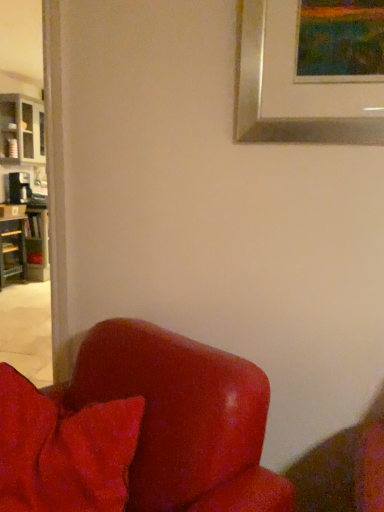
Question: From the image's perspective, is satin red armchair at lower left above or below wooden bookshelf at left?

Choices:
 (A) above
 (B) below

Answer: (B)

Question: Based on their positions, is satin red armchair at lower left located to the left or right of wooden bookshelf at left?

Choices:
 (A) right
 (B) left

Answer: (A)

Question: Which object is the closest to the satin red armchair at lower left?

Choices:
 (A) wooden bookshelf at left
 (B) velvety red pillow at lower left
 (C) matte gray cabinet at left

Answer: (B)

Question: Estimate the real-world distances between objects in this image. Which object is closer to the wooden bookshelf at left?

Choices:
 (A) velvety red pillow at lower left
 (B) matte gray cabinet at left
 (C) satin red armchair at lower left

Answer: (B)